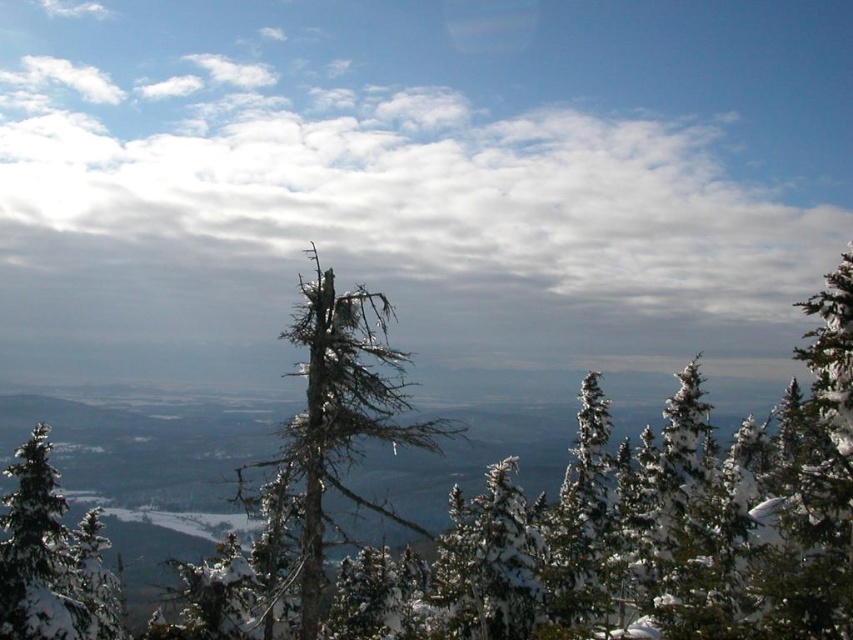
Question: Which point appears farthest from the camera in this image?

Choices:
 (A) (271, 595)
 (B) (480, 193)

Answer: (B)

Question: Is white fluffy cloud at upper center to the right of white frosty tree at left from the viewer's perspective?

Choices:
 (A) yes
 (B) no

Answer: (B)

Question: Which object is the closest to the white frosty tree at left?

Choices:
 (A) white fluffy cloud at upper center
 (B) snow-covered bare tree at center
 (C) snow-covered tree at center

Answer: (B)

Question: Which point appears farthest from the camera in this image?

Choices:
 (A) (67, 566)
 (B) (91, 515)

Answer: (B)

Question: Can you confirm if snow-covered tree at center is bigger than white frosty tree at left?

Choices:
 (A) no
 (B) yes

Answer: (B)

Question: Is snow-covered tree at center above snow-covered bare tree at center?

Choices:
 (A) no
 (B) yes

Answer: (B)